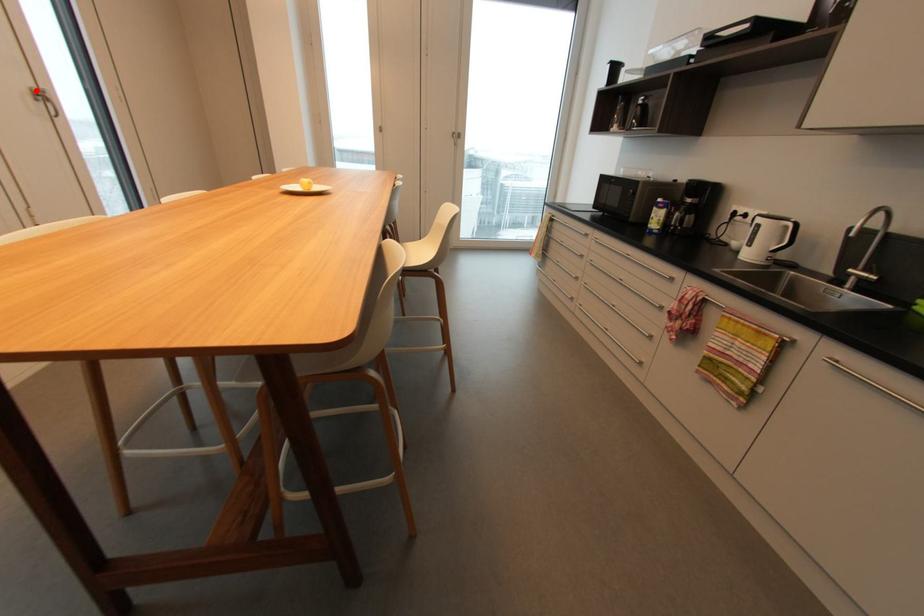
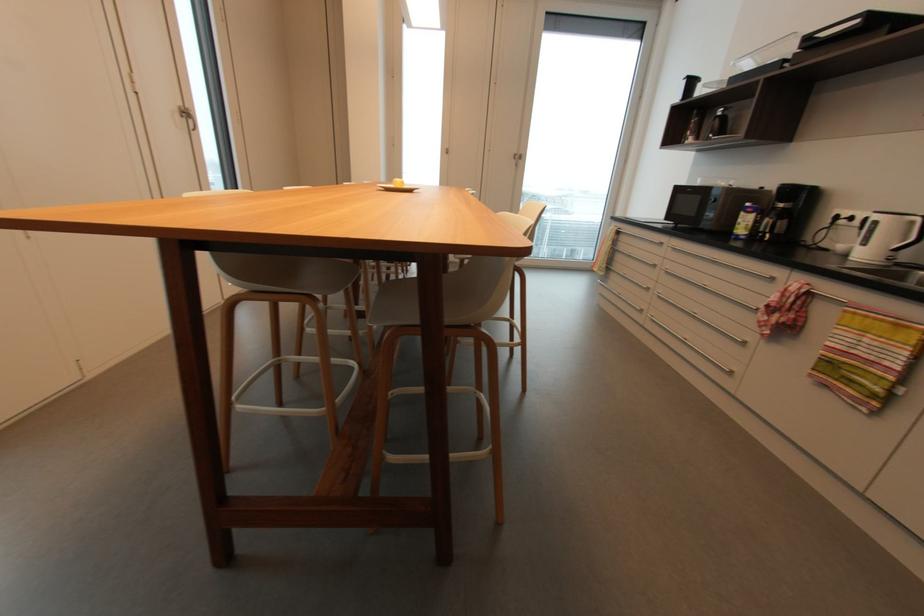
The point at the highlighted location is marked in the first image. Where is the corresponding point in the second image?

(183, 108)